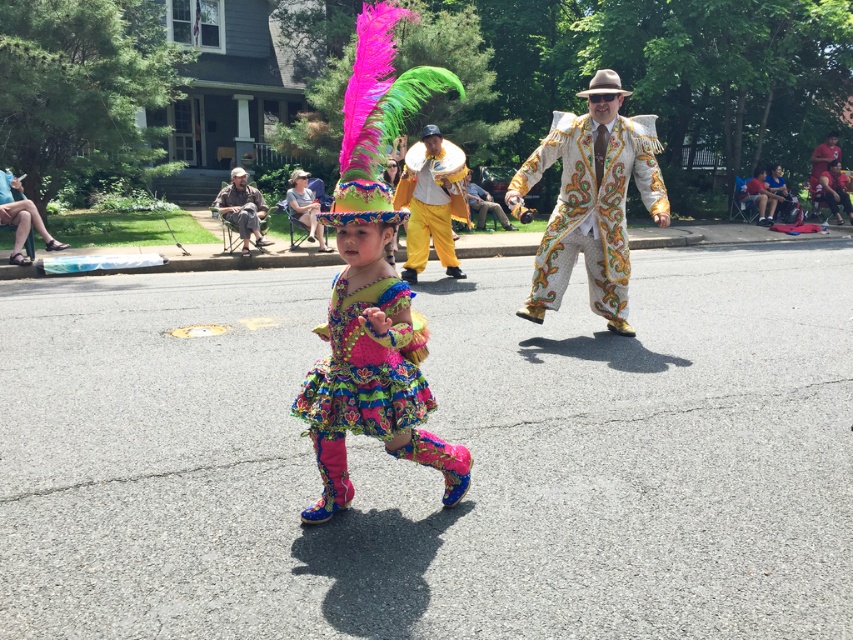
Is yellow satin pants at center positioned at the back of matte yellow hat at upper center?

No, yellow satin pants at center is in front of matte yellow hat at upper center.

What do you see at coordinates (428, 212) in the screenshot? I see `yellow satin pants at center` at bounding box center [428, 212].

What do you see at coordinates (428, 212) in the screenshot? This screenshot has height=640, width=853. I see `yellow satin pants at center` at bounding box center [428, 212].

In order to click on yellow satin pants at center in this screenshot , I will do `click(428, 212)`.

Looking at this image, does white textured suit at center have a smaller size compared to beige fabric chair at left?

No.

Is white textured suit at center in front of beige fabric chair at left?

Yes, white textured suit at center is closer to the viewer.

What are the coordinates of `white textured suit at center` in the screenshot? It's located at (592, 202).

Is multicolored sequined dress at center to the left of beige fabric chair at left from the viewer's perspective?

Incorrect, multicolored sequined dress at center is not on the left side of beige fabric chair at left.

Can you confirm if multicolored sequined dress at center is taller than beige fabric chair at left?

Yes, multicolored sequined dress at center is taller than beige fabric chair at left.

Which is in front, point (370, 268) or point (248, 208)?

Point (370, 268)

The height and width of the screenshot is (640, 853). Identify the location of multicolored sequined dress at center. point(373,288).